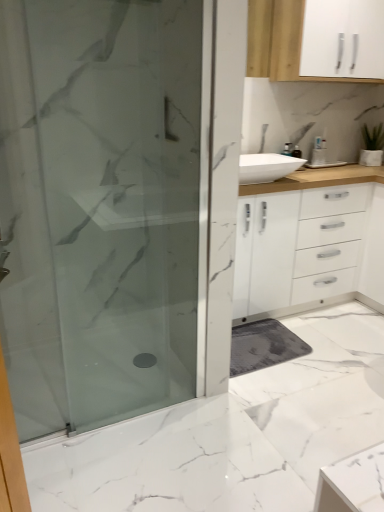
This screenshot has width=384, height=512. In order to click on vacant space behind frosted glass shower door at left in this screenshot , I will do `click(130, 390)`.